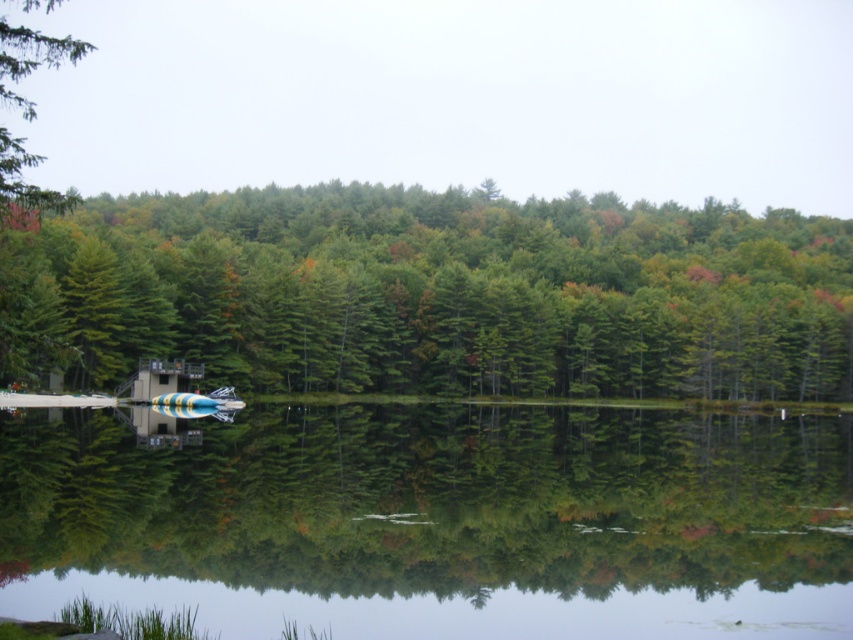
Is green matte tree at center to the left of green matte tree at upper left from the viewer's perspective?

Incorrect, green matte tree at center is not on the left side of green matte tree at upper left.

Find the location of a particular element. This screenshot has width=853, height=640. green matte tree at center is located at coordinates (433, 294).

This screenshot has width=853, height=640. In order to click on green matte tree at center in this screenshot , I will do `click(433, 294)`.

The image size is (853, 640). I want to click on green matte tree at center, so click(x=433, y=294).

Which is behind, point (520, 595) or point (15, 68)?

The point (520, 595) is behind.

Which is more to the right, clear water at center or green matte tree at upper left?

clear water at center

You are a GUI agent. You are given a task and a screenshot of the screen. Output one action in this format:
    pyautogui.click(x=<x>, y=<y>)
    Task: Click on the clear water at center
    This screenshot has height=640, width=853.
    Given the screenshot: What is the action you would take?
    pyautogui.click(x=439, y=522)

I want to click on clear water at center, so click(x=439, y=522).

From the picture: Between clear water at center and green matte tree at center, which one is positioned higher?

Positioned higher is green matte tree at center.

Measure the distance from clear water at center to green matte tree at center.

82.36 meters

Is point (180, 502) more distant than point (4, 324)?

Yes, point (180, 502) is farther from viewer.

Locate an element on the screen. clear water at center is located at coordinates (439, 522).